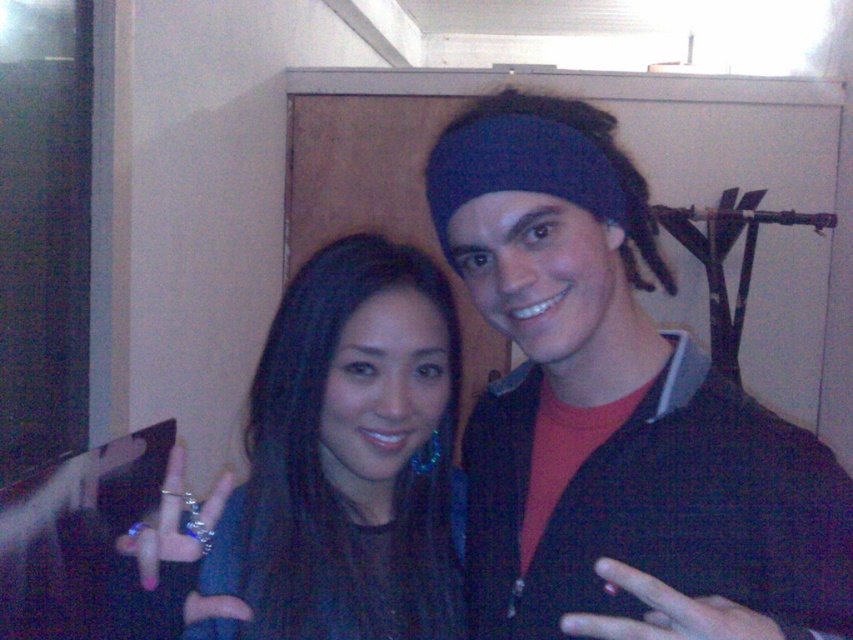
Measure the distance between matte black hair at center and satin black hair at center.

matte black hair at center and satin black hair at center are 6.55 inches apart.

Between point (630, 202) and point (280, 588), which one is positioned in front?

Point (280, 588)

Locate an element on the screen. This screenshot has width=853, height=640. matte black hair at center is located at coordinates (650, 515).